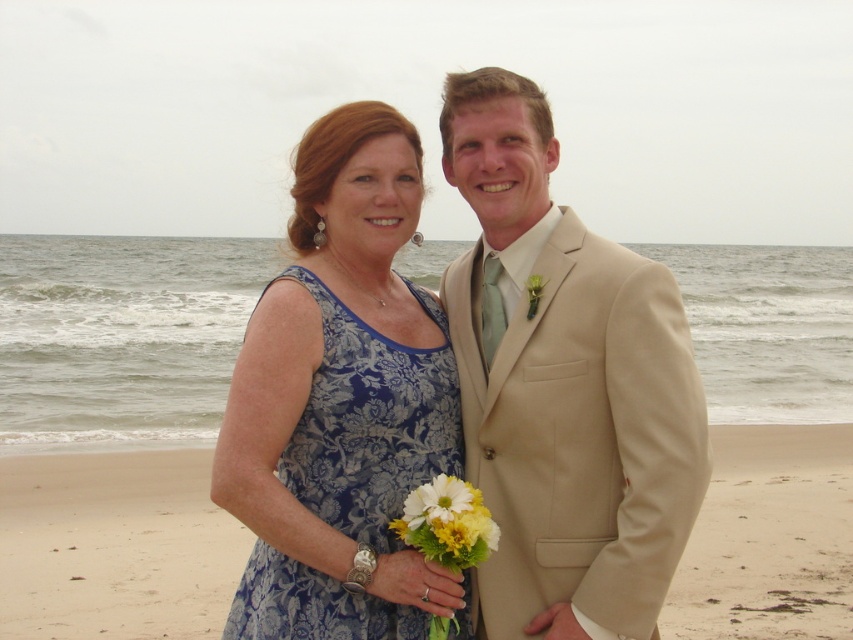
Question: Among these points, which one is nearest to the camera?

Choices:
 (A) (604, 385)
 (B) (445, 529)
 (C) (274, 280)

Answer: (B)

Question: Can you confirm if beige suit at center is smaller than white/yellow fabric bouquet at center?

Choices:
 (A) yes
 (B) no

Answer: (B)

Question: Is white/yellow fabric bouquet at center positioned behind white matte flower at center?

Choices:
 (A) yes
 (B) no

Answer: (B)

Question: Does beige sand at lower center have a lesser width compared to white/yellow fabric bouquet at center?

Choices:
 (A) yes
 (B) no

Answer: (B)

Question: Which point is farther to the camera?

Choices:
 (A) beige suit at center
 (B) white/yellow fabric bouquet at center

Answer: (A)

Question: Which of the following is the closest to the observer?

Choices:
 (A) blue damask dress at center
 (B) beige sand at lower center
 (C) white matte flower at center
 (D) white/yellow fabric bouquet at center

Answer: (D)